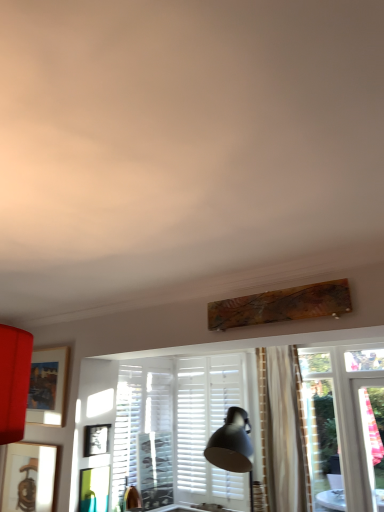
Question: From the image's perspective, would you say white matte shutter at center is positioned over matte wooden picture frame at left, which ranks as the 1th picture frame in top-to-bottom order?

Choices:
 (A) no
 (B) yes

Answer: (A)

Question: Is white matte shutter at center taller than matte wooden picture frame at left, the third picture frame ordered from the bottom?

Choices:
 (A) no
 (B) yes

Answer: (B)

Question: Does white matte shutter at center have a smaller size compared to matte wooden picture frame at left, which ranks as the 1th picture frame in top-to-bottom order?

Choices:
 (A) no
 (B) yes

Answer: (A)

Question: Could you tell me if white matte shutter at center is turned towards matte wooden picture frame at left, which ranks as the 1th picture frame in top-to-bottom order?

Choices:
 (A) yes
 (B) no

Answer: (B)

Question: From a real-world perspective, is white matte shutter at center located beneath matte wooden picture frame at left, which ranks as the 1th picture frame in top-to-bottom order?

Choices:
 (A) no
 (B) yes

Answer: (B)

Question: Does white matte shutter at center have a lesser height compared to matte wooden picture frame at left, the third picture frame ordered from the bottom?

Choices:
 (A) yes
 (B) no

Answer: (B)

Question: From the image's perspective, does wooden picture frame at lower left, which is the 1th picture frame from bottom to top, appear higher than matte black picture frame at center, marked as the 2th picture frame in a bottom-to-top arrangement?

Choices:
 (A) yes
 (B) no

Answer: (B)

Question: From the image's perspective, does wooden picture frame at lower left, which is the 1th picture frame from bottom to top, appear lower than matte black picture frame at center, which is counted as the second picture frame, starting from the top?

Choices:
 (A) no
 (B) yes

Answer: (B)

Question: Does wooden picture frame at lower left, which is the 1th picture frame from bottom to top, have a lesser width compared to matte black picture frame at center, marked as the 2th picture frame in a bottom-to-top arrangement?

Choices:
 (A) no
 (B) yes

Answer: (B)

Question: Is wooden picture frame at lower left, which is the 1th picture frame from bottom to top, further to camera compared to matte black picture frame at center, marked as the 2th picture frame in a bottom-to-top arrangement?

Choices:
 (A) no
 (B) yes

Answer: (A)

Question: Is wooden picture frame at lower left, which appears as the third picture frame when viewed from the top, shorter than matte black picture frame at center, marked as the 2th picture frame in a bottom-to-top arrangement?

Choices:
 (A) no
 (B) yes

Answer: (A)

Question: Can you confirm if wooden picture frame at lower left, which appears as the third picture frame when viewed from the top, is taller than matte black picture frame at center, which is counted as the second picture frame, starting from the top?

Choices:
 (A) yes
 (B) no

Answer: (A)

Question: Is white matte shutter at center thinner than matte black picture frame at center, which is counted as the second picture frame, starting from the top?

Choices:
 (A) yes
 (B) no

Answer: (B)